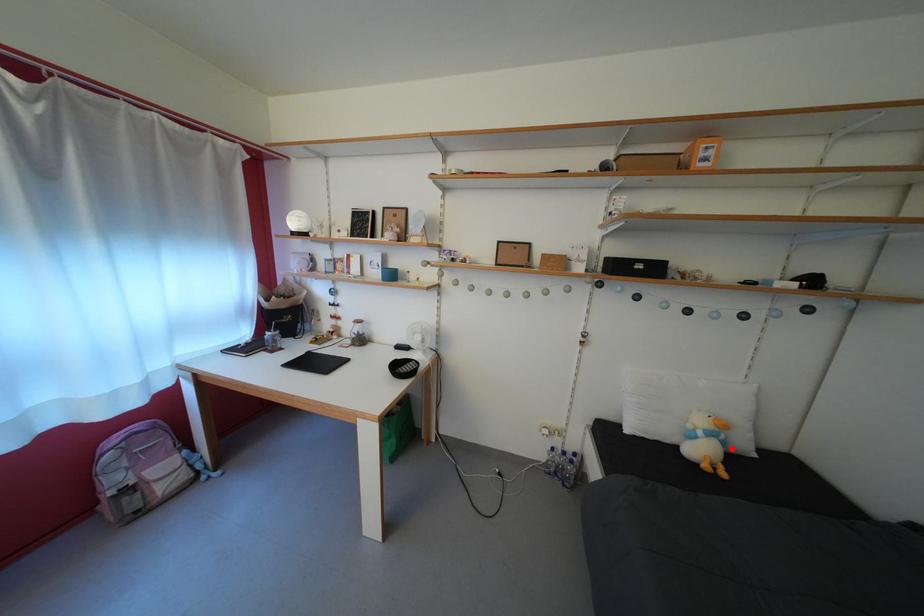
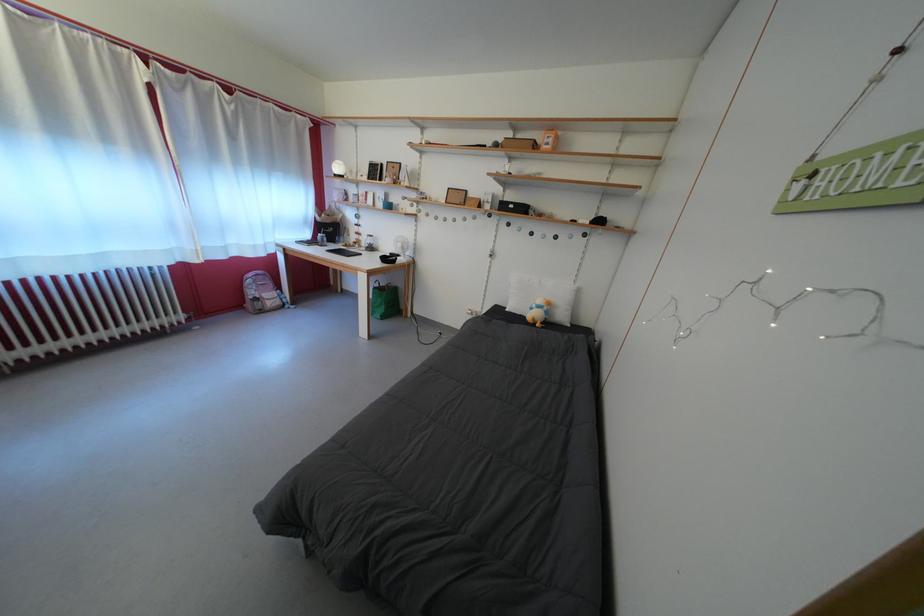
The point at the highlighted location is marked in the first image. Where is the corresponding point in the second image?

(554, 318)